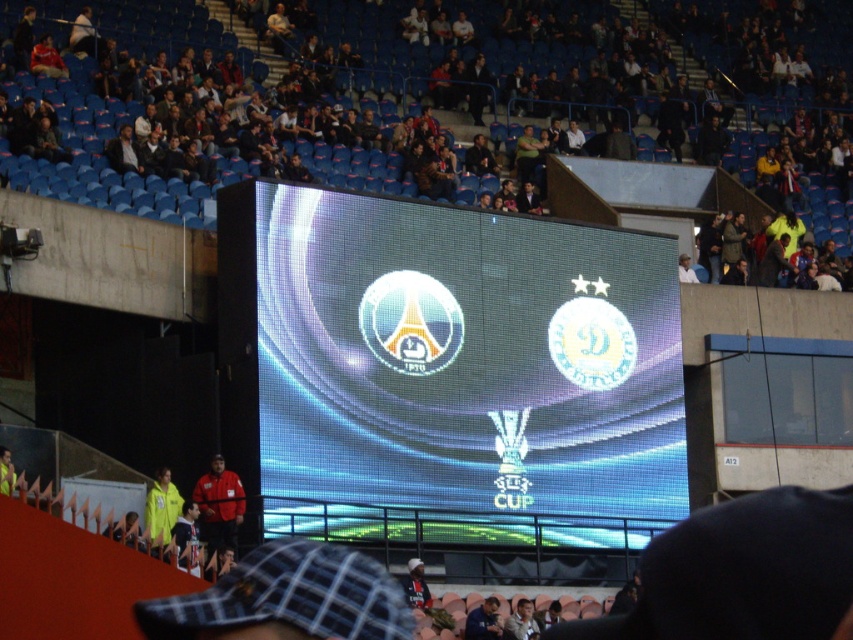
Question: Is red jacket at lower left thinner than yellow fabric jacket at lower left?

Choices:
 (A) no
 (B) yes

Answer: (A)

Question: Which object appears closest to the camera in this image?

Choices:
 (A) dark blue seats at upper center
 (B) yellow fabric jacket at lower left

Answer: (B)

Question: Which of the following is the farthest from the observer?

Choices:
 (A) yellow fabric jacket at lower left
 (B) red jacket at lower left

Answer: (B)

Question: Can you confirm if dark blue seats at upper center is positioned below red jacket at lower left?

Choices:
 (A) no
 (B) yes

Answer: (A)

Question: Estimate the real-world distances between objects in this image. Which object is closer to the red jacket at lower left?

Choices:
 (A) yellow fabric jacket at lower left
 (B) shiny led display at center
 (C) dark blue seats at upper center

Answer: (A)

Question: Does dark blue seats at upper center lie in front of yellow fabric jacket at lower left?

Choices:
 (A) yes
 (B) no

Answer: (B)